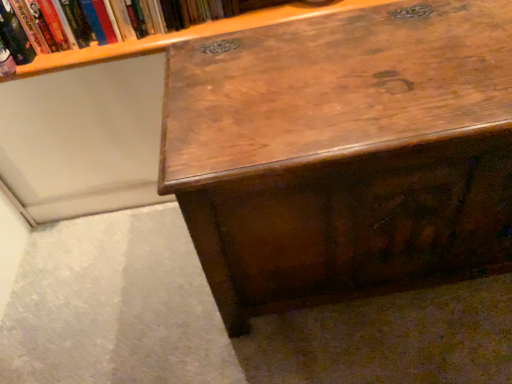
In order to face hardcover book at upper left, should I rotate leftwards or rightwards?

Rotate your view left by about 16.151°.

Image resolution: width=512 pixels, height=384 pixels. In order to click on hardcover book at upper left in this screenshot , I will do `click(31, 29)`.

Describe the element at coordinates (31, 29) in the screenshot. This screenshot has height=384, width=512. I see `hardcover book at upper left` at that location.

What is the approximate width of shiny brown wood desk at center?

shiny brown wood desk at center is 20.17 inches wide.

Locate an element on the screen. Image resolution: width=512 pixels, height=384 pixels. shiny brown wood desk at center is located at coordinates (343, 153).

Describe the element at coordinates (343, 153) in the screenshot. I see `shiny brown wood desk at center` at that location.

The image size is (512, 384). In order to click on hardcover book at upper left in this screenshot , I will do `click(31, 29)`.

Between hardcover book at upper left and shiny brown wood desk at center, which one appears on the left side from the viewer's perspective?

Positioned to the left is hardcover book at upper left.

Which object is closer to the camera, hardcover book at upper left or shiny brown wood desk at center?

shiny brown wood desk at center is in front.

Is point (252, 1) closer or farther from the camera than point (493, 94)?

Point (252, 1) is farther from the camera than point (493, 94).

From the image's perspective, is hardcover book at upper left located above or below shiny brown wood desk at center?

Clearly, from the image's perspective, hardcover book at upper left is above shiny brown wood desk at center.

From the picture: From a real-world perspective, is hardcover book at upper left on shiny brown wood desk at center?

Yes, from a real-world perspective, hardcover book at upper left is on top of shiny brown wood desk at center.

Considering the sizes of objects hardcover book at upper left and shiny brown wood desk at center in the image provided, who is wider, hardcover book at upper left or shiny brown wood desk at center?

Wider between the two is shiny brown wood desk at center.

Is hardcover book at upper left taller or shorter than shiny brown wood desk at center?

Considering their sizes, hardcover book at upper left has less height than shiny brown wood desk at center.

Who is bigger, hardcover book at upper left or shiny brown wood desk at center?

Bigger between the two is shiny brown wood desk at center.

Choose the correct answer: Is hardcover book at upper left inside shiny brown wood desk at center or outside it?

hardcover book at upper left cannot be found inside shiny brown wood desk at center.

Is hardcover book at upper left beside shiny brown wood desk at center?

There is a gap between hardcover book at upper left and shiny brown wood desk at center.

Is hardcover book at upper left looking in the opposite direction of shiny brown wood desk at center?

No, hardcover book at upper left is not facing the opposite direction of shiny brown wood desk at center.

Locate an element on the screen. Image resolution: width=512 pixels, height=384 pixels. book above the shiny brown wood desk at center (from the image's perspective) is located at coordinates [31, 29].

Is shiny brown wood desk at center at the left side of hardcover book at upper left?

No, shiny brown wood desk at center is not to the left of hardcover book at upper left.

In the scene shown: Is the position of shiny brown wood desk at center less distant than that of hardcover book at upper left?

Yes, shiny brown wood desk at center is in front of hardcover book at upper left.

Which is closer to the camera, (413, 114) or (80, 32)?

The point (413, 114) is closer to the camera.

From the image's perspective, is shiny brown wood desk at center located above or below hardcover book at upper left?

From the image's perspective, shiny brown wood desk at center appears below hardcover book at upper left.

From a real-world perspective, who is located higher, shiny brown wood desk at center or hardcover book at upper left?

hardcover book at upper left is physically above.

Between shiny brown wood desk at center and hardcover book at upper left, which one has smaller width?

hardcover book at upper left is thinner.

Between shiny brown wood desk at center and hardcover book at upper left, which one has more height?

shiny brown wood desk at center.

Considering the relative sizes of shiny brown wood desk at center and hardcover book at upper left in the image provided, is shiny brown wood desk at center smaller than hardcover book at upper left?

No.

Is shiny brown wood desk at center spatially inside hardcover book at upper left, or outside of it?

shiny brown wood desk at center lies outside hardcover book at upper left.

Would you consider shiny brown wood desk at center to be distant from hardcover book at upper left?

They are positioned close to each other.

Is shiny brown wood desk at center facing towards hardcover book at upper left?

No, shiny brown wood desk at center does not turn towards hardcover book at upper left.

Measure the distance between shiny brown wood desk at center and hardcover book at upper left.

A distance of 18.88 inches exists between shiny brown wood desk at center and hardcover book at upper left.

The image size is (512, 384). In order to click on desk on the right of hardcover book at upper left in this screenshot , I will do `click(343, 153)`.

I want to click on book that appears above the shiny brown wood desk at center (from the image's perspective), so click(31, 29).

The width and height of the screenshot is (512, 384). What are the coordinates of `desk in front of the hardcover book at upper left` in the screenshot? It's located at coord(343,153).